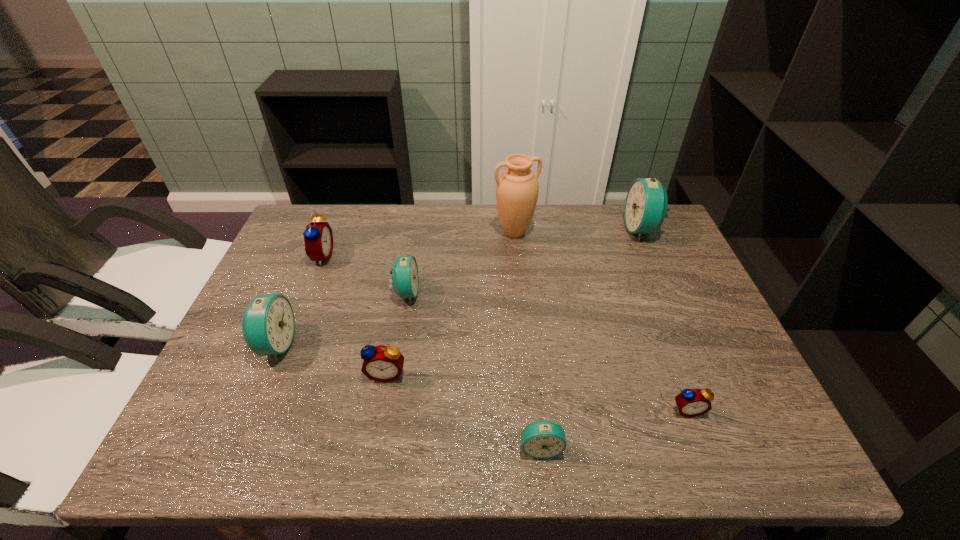
You are a GUI agent. You are given a task and a screenshot of the screen. Output one action in this format:
    pyautogui.click(x=<x>, y=<y>)
    Task: Click on the vacant space at the left edge of the desktop
    The height and width of the screenshot is (540, 960).
    Given the screenshot: What is the action you would take?
    pyautogui.click(x=297, y=294)

Find the location of `vacant space at the right edge of the desktop`. vacant space at the right edge of the desktop is located at coordinates (x=711, y=369).

Find the location of a particular element. The image size is (960, 540). vacant space at the far left corner is located at coordinates point(350,206).

Find the location of a particular element. This screenshot has height=540, width=960. free space at the near right corner is located at coordinates (751, 440).

At what (x,y) coordinates should I click in order to perform the action: click on free space between the second smallest red alarm clock and the smallest red alarm clock. Please return your answer as a coordinate pair (x, y). Looking at the image, I should click on [x=537, y=392].

Identify the location of blank region between the rightmost red alarm clock and the tallest object. The height and width of the screenshot is (540, 960). (601, 321).

Where is `unoccupied position between the nearest blue alarm clock and the third farthest blue alarm clock`? The height and width of the screenshot is (540, 960). unoccupied position between the nearest blue alarm clock and the third farthest blue alarm clock is located at coordinates (408, 396).

Find the location of a particular element. vacant area that lies between the smallest red alarm clock and the leftmost red alarm clock is located at coordinates (504, 333).

The height and width of the screenshot is (540, 960). I want to click on unoccupied area between the second red alarm clock from right to left and the third biggest blue alarm clock, so pyautogui.click(x=396, y=333).

Where is `free spot between the farthest red alarm clock and the farthest blue alarm clock`? The image size is (960, 540). free spot between the farthest red alarm clock and the farthest blue alarm clock is located at coordinates (481, 243).